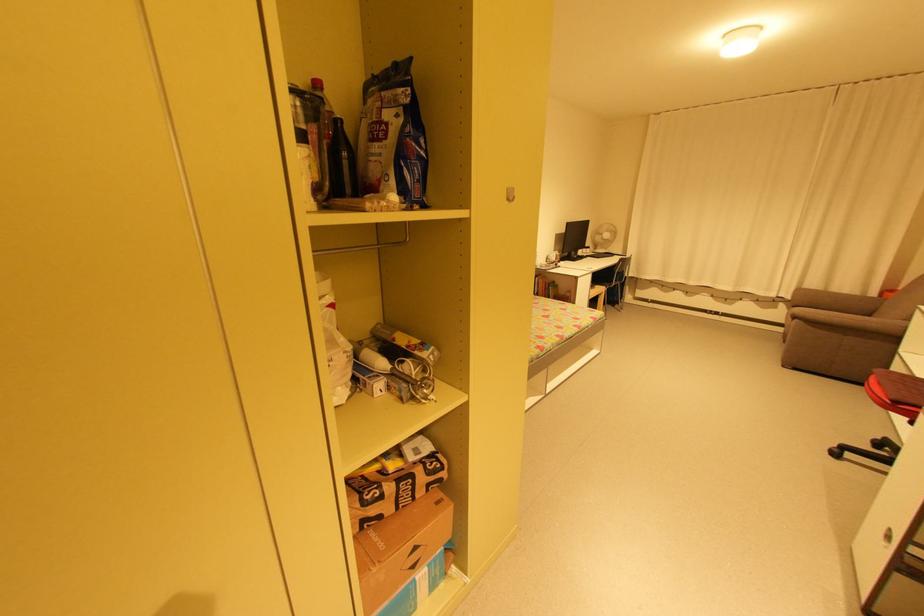
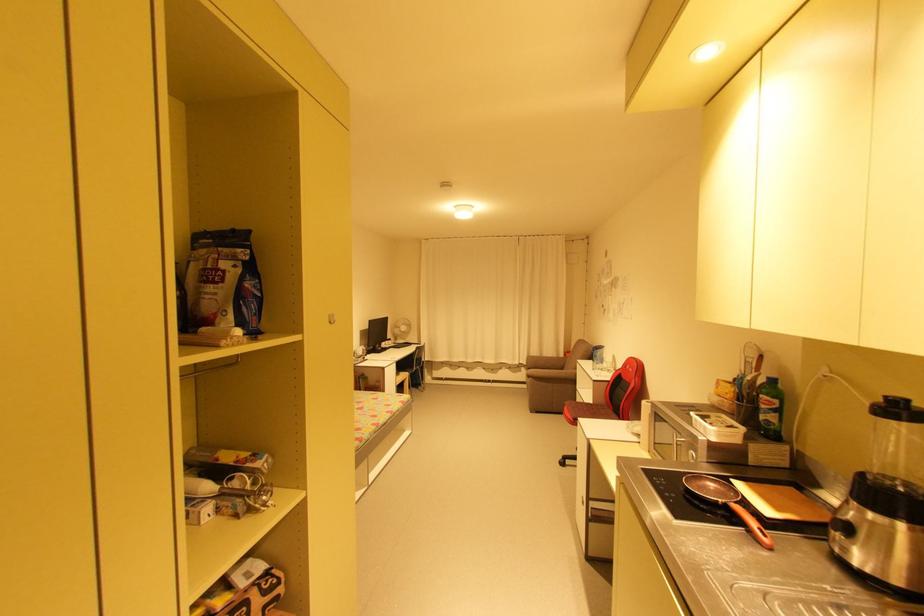
Question: The camera is either moving clockwise (left) or counter-clockwise (right) around the object. The first image is from the beginning of the video and the second image is from the end. Is the camera moving left or right when shooting the video?

Choices:
 (A) Left
 (B) Right

Answer: (A)